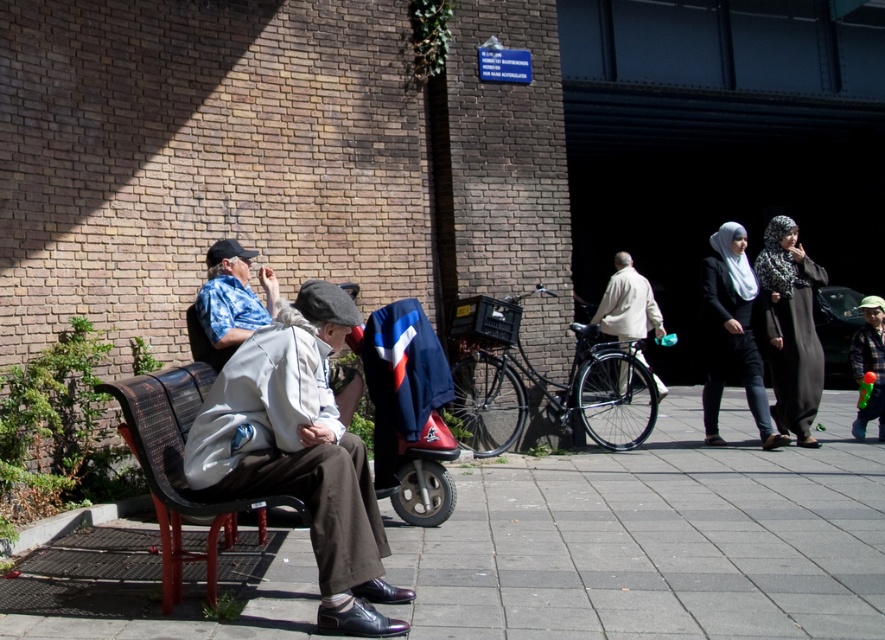
Who is more forward, (599, 628) or (375, 499)?

Point (599, 628)

Who is more forward, [435,540] or [363,550]?

Point [363,550]

I want to click on smooth concrete pavement at lower left, so click(658, 538).

Between light gray fabric coat at center and white scarf at center, which one has more height?

white scarf at center is taller.

Is point (262, 481) positioned after point (751, 307)?

No, (262, 481) is in front of (751, 307).

Is point (204, 460) closer to camera compared to point (708, 403)?

Yes.

Where is `light gray fabric coat at center`? The image size is (885, 640). light gray fabric coat at center is located at coordinates tap(299, 452).

Does dark gray textured abaya at right have a larger size compared to light beige jacket at center?

Yes, dark gray textured abaya at right is bigger than light beige jacket at center.

Between dark gray textured abaya at right and light beige jacket at center, which one has less height?

With less height is light beige jacket at center.

Between point (782, 308) and point (643, 356), which one is positioned in front?

Point (782, 308) is more forward.

What are the coordinates of `dark gray textured abaya at right` in the screenshot? It's located at (790, 326).